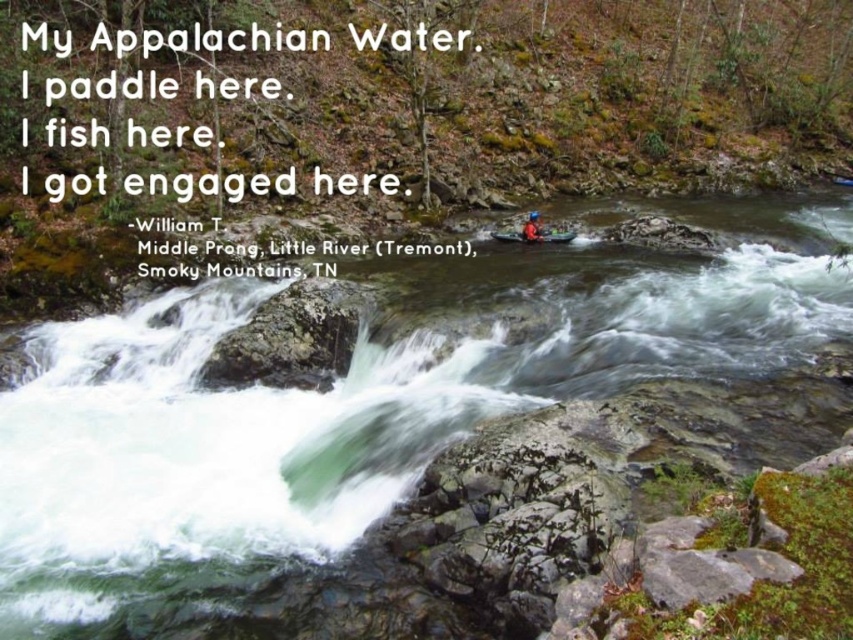
Question: Can you confirm if white frothy water at center is bigger than matte red kayak at center?

Choices:
 (A) no
 (B) yes

Answer: (B)

Question: Among these points, which one is farthest from the camera?

Choices:
 (A) 496,240
 (B) 155,380
 (C) 529,230

Answer: (A)

Question: Among these points, which one is farthest from the camera?

Choices:
 (A) (770, 248)
 (B) (527, 224)

Answer: (B)

Question: Is matte red kayak at center above orange fabric kayak at upper right?

Choices:
 (A) yes
 (B) no

Answer: (B)

Question: Does white frothy water at center lie behind orange fabric kayak at upper right?

Choices:
 (A) yes
 (B) no

Answer: (B)

Question: Which of the following is the farthest from the observer?

Choices:
 (A) (547, 234)
 (B) (219, 397)
 (C) (523, 234)

Answer: (C)